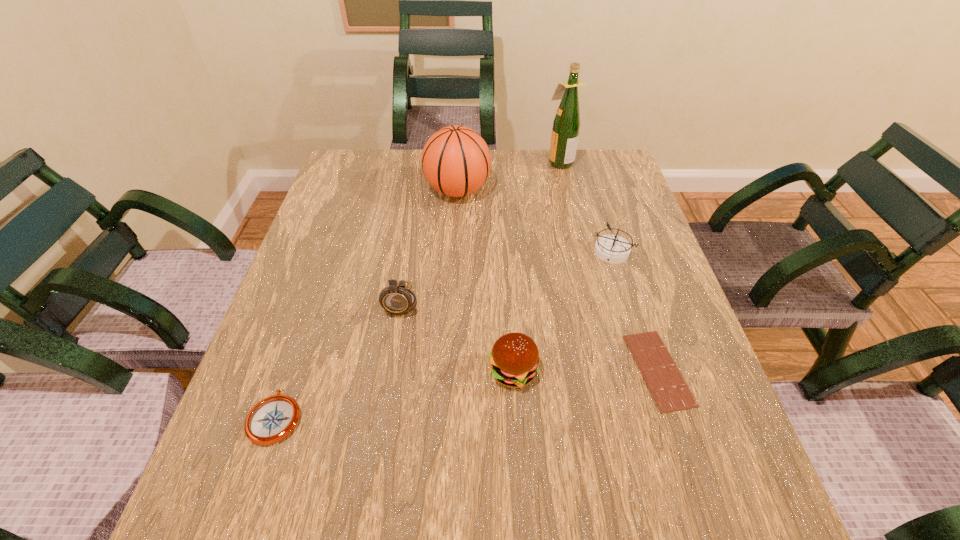
Where is `the farthest object`? the farthest object is located at coordinates (566, 125).

The height and width of the screenshot is (540, 960). In order to click on liquor in this screenshot , I will do `click(566, 125)`.

Identify the location of basketball. (456, 161).

Where is `the second tallest object`? Image resolution: width=960 pixels, height=540 pixels. the second tallest object is located at coordinates (456, 161).

This screenshot has height=540, width=960. What are the coordinates of `the second compass from left to right` in the screenshot? It's located at (397, 300).

This screenshot has width=960, height=540. I want to click on the tallest compass, so click(x=397, y=300).

The image size is (960, 540). In order to click on hamburger in this screenshot , I will do `click(514, 359)`.

At what (x,y) coordinates should I click in order to perform the action: click on the farthest compass. Please return your answer as a coordinate pair (x, y). Image resolution: width=960 pixels, height=540 pixels. Looking at the image, I should click on (614, 249).

In order to click on the second tallest compass in this screenshot , I will do `click(614, 249)`.

Identify the location of the shortest compass. (272, 419).